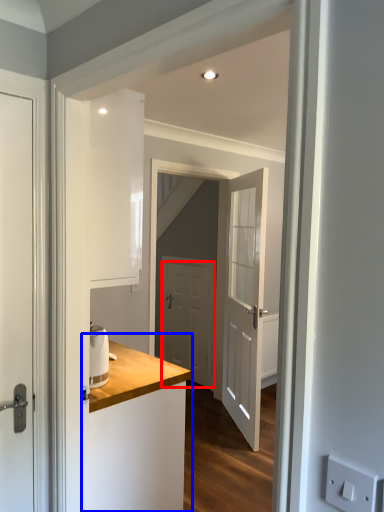
Question: Which point is further to the camera, door (highlighted by a red box) or counter (highlighted by a blue box)?

Choices:
 (A) door
 (B) counter

Answer: (A)